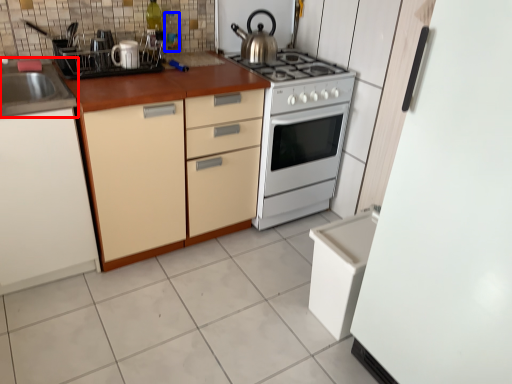
Question: Which point is further to the camera, sink (highlighted by a red box) or bottle (highlighted by a blue box)?

Choices:
 (A) sink
 (B) bottle

Answer: (B)